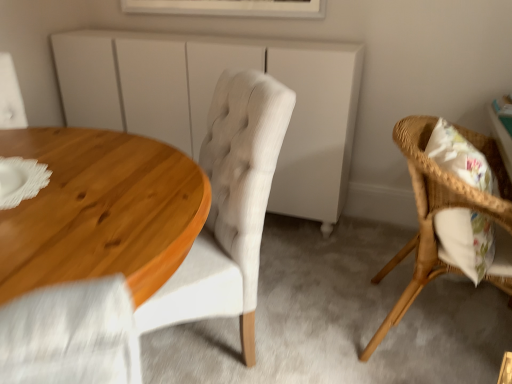
Question: In which direction should I rotate to look at light beige fabric chair at center, which is the first chair in left-to-right order?

Choices:
 (A) right
 (B) left

Answer: (B)

Question: Is light beige fabric chair at center, the 2th chair positioned from the right, far from woven wood chair at right, marked as the 2th chair in a left-to-right arrangement?

Choices:
 (A) yes
 (B) no

Answer: (B)

Question: From the image's perspective, is light beige fabric chair at center, which is the first chair in left-to-right order, located above woven wood chair at right, which is the 1th chair in right-to-left order?

Choices:
 (A) yes
 (B) no

Answer: (A)

Question: Is light beige fabric chair at center, the 2th chair positioned from the right, looking in the opposite direction of woven wood chair at right, marked as the 2th chair in a left-to-right arrangement?

Choices:
 (A) no
 (B) yes

Answer: (A)

Question: Is light beige fabric chair at center, the 2th chair positioned from the right, located outside woven wood chair at right, which is the 1th chair in right-to-left order?

Choices:
 (A) no
 (B) yes

Answer: (B)

Question: Is light beige fabric chair at center, which is the first chair in left-to-right order, further to camera compared to woven wood chair at right, which is the 1th chair in right-to-left order?

Choices:
 (A) yes
 (B) no

Answer: (B)

Question: Can you confirm if light beige fabric chair at center, which is the first chair in left-to-right order, is positioned to the right of woven wood chair at right, marked as the 2th chair in a left-to-right arrangement?

Choices:
 (A) no
 (B) yes

Answer: (A)

Question: Can you confirm if woven wood chair at right, which is the 1th chair in right-to-left order, is thinner than wooden table at left?

Choices:
 (A) yes
 (B) no

Answer: (A)

Question: From a real-world perspective, is woven wood chair at right, marked as the 2th chair in a left-to-right arrangement, over wooden table at left?

Choices:
 (A) no
 (B) yes

Answer: (A)

Question: Does woven wood chair at right, which is the 1th chair in right-to-left order, have a greater height compared to wooden table at left?

Choices:
 (A) no
 (B) yes

Answer: (A)

Question: Is woven wood chair at right, which is the 1th chair in right-to-left order, positioned far away from wooden table at left?

Choices:
 (A) yes
 (B) no

Answer: (B)

Question: Is woven wood chair at right, which is the 1th chair in right-to-left order, facing away from wooden table at left?

Choices:
 (A) no
 (B) yes

Answer: (A)

Question: Would you say woven wood chair at right, marked as the 2th chair in a left-to-right arrangement, is outside wooden table at left?

Choices:
 (A) no
 (B) yes

Answer: (B)

Question: From a real-world perspective, is white framed picture at upper center over white matte cabinet at center?

Choices:
 (A) no
 (B) yes

Answer: (B)